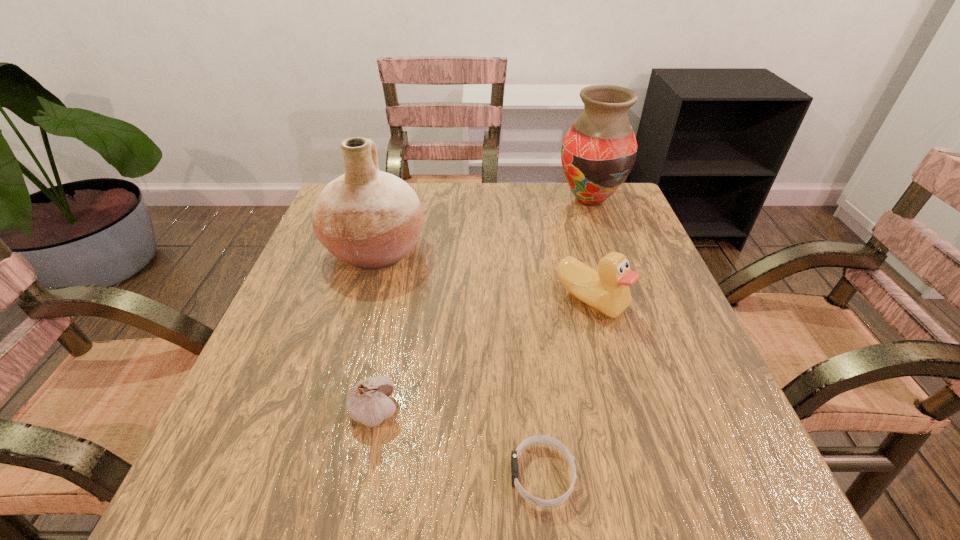
This screenshot has height=540, width=960. I want to click on free spot located on the back of the second shortest object, so click(x=401, y=276).

The width and height of the screenshot is (960, 540). I want to click on vacant space situated on the outer surface of the shortest object, so click(427, 475).

The width and height of the screenshot is (960, 540). In order to click on free space located 0.150m on the outer surface of the shortest object in this screenshot , I will do `click(406, 475)`.

In order to click on vacant position located on the outer surface of the shortest object in this screenshot , I will do `click(300, 475)`.

What are the coordinates of `vase present at the far edge` in the screenshot? It's located at (598, 152).

You are a GUI agent. You are given a task and a screenshot of the screen. Output one action in this format:
    pyautogui.click(x=<x>, y=<y>)
    Task: Click on the pottery present at the far edge
    This screenshot has height=540, width=960.
    Given the screenshot: What is the action you would take?
    pyautogui.click(x=370, y=219)

This screenshot has height=540, width=960. What are the coordinates of `object at the near edge` in the screenshot? It's located at (x=544, y=439).

The height and width of the screenshot is (540, 960). Find the location of `object present at the left edge`. object present at the left edge is located at coordinates (370, 219).

Identify the location of vase that is at the right edge. 598,152.

What are the coordinates of `duck present at the right edge` in the screenshot? It's located at (607, 290).